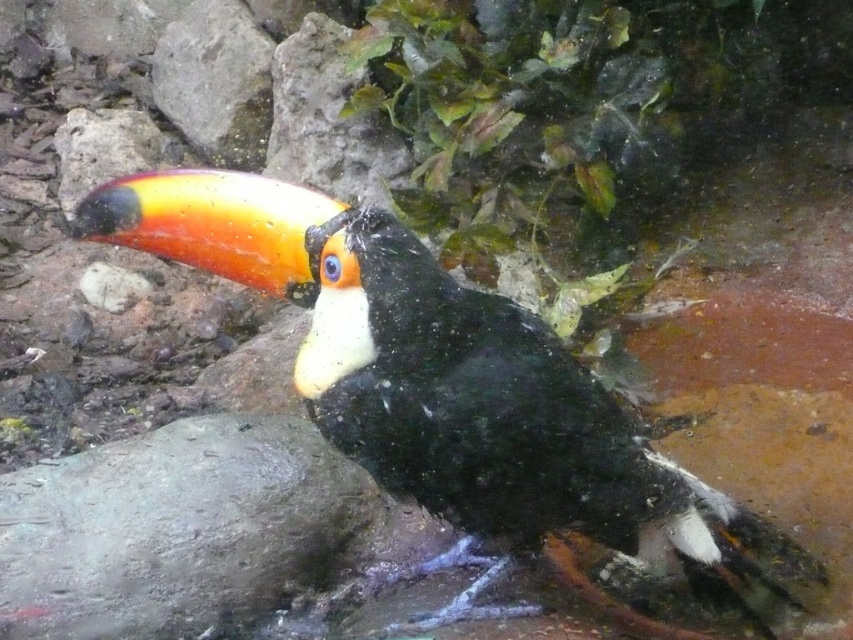
From the picture: You are a birdwatcher observing the scene. You notice the shiny black toucan at center and the gray rough stone at lower left. Which object is positioned higher from the ground?

The shiny black toucan at center is located above the gray rough stone at lower left, so it is positioned higher from the ground.

You are a photographer trying to capture the toucan in the image. You notice two points in the scene marked as point 1 at coordinates point (167, 212) and point 2 at coordinates point (279, 522). Which point is closer to you, the photographer?

Point (167, 212) is closer to the viewer than point (279, 522).

You are a birdwatcher observing the scene. You notice the shiny black toucan at center and the gray rough stone at lower left. Which object is taller?

The shiny black toucan at center is much taller than the gray rough stone at lower left.